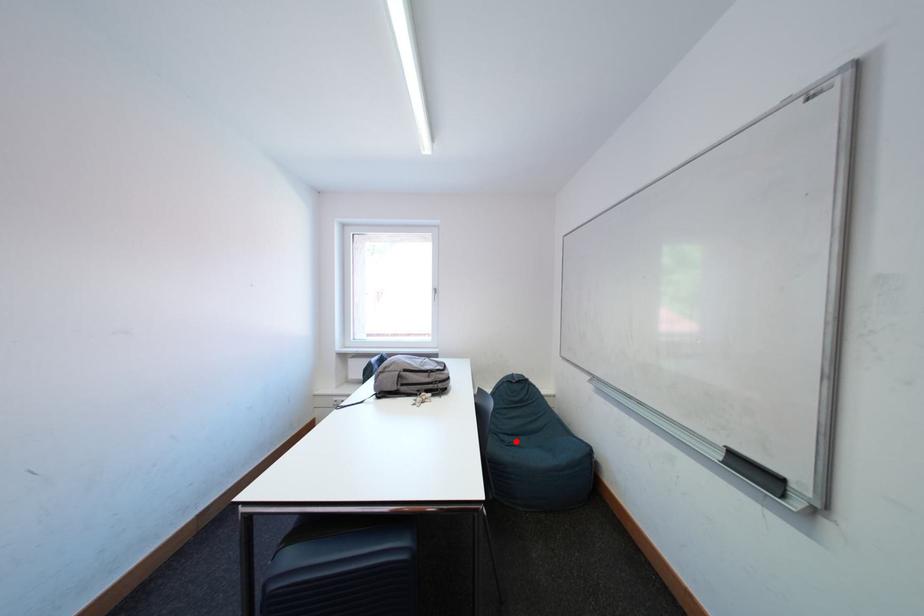
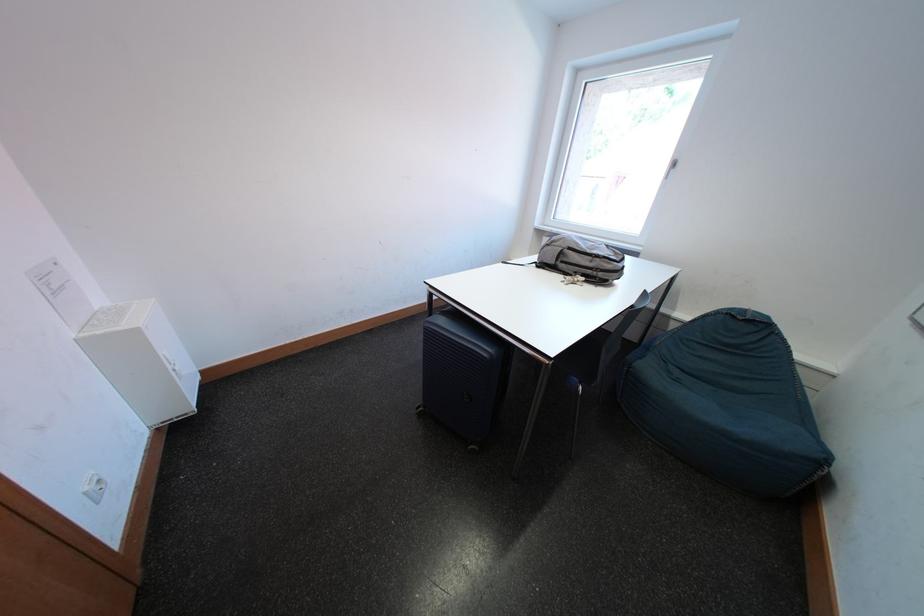
Question: I am providing you with two images of the same scene from different viewpoints. A red point is shown in image1. For the corresponding object point in image2, is it positioned nearer or farther from the camera?

Choices:
 (A) Nearer
 (B) Farther

Answer: (A)